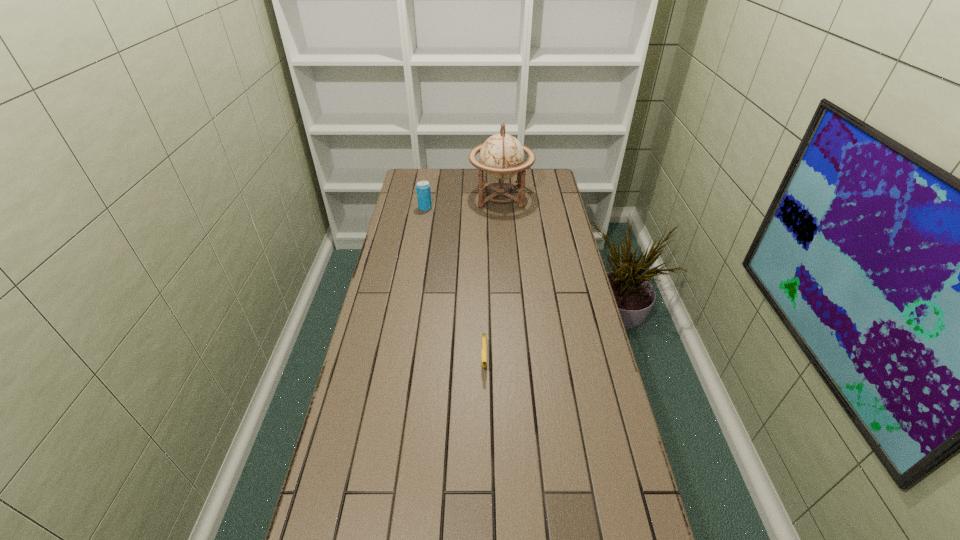
The height and width of the screenshot is (540, 960). In order to click on the tallest object in this screenshot , I will do `click(501, 156)`.

Locate an element on the screen. the second tallest object is located at coordinates (423, 187).

What are the coordinates of `the leftmost object` in the screenshot? It's located at (423, 187).

Find the location of `the nearest object`. the nearest object is located at coordinates (484, 342).

This screenshot has height=540, width=960. In order to click on the shortest object in this screenshot , I will do `click(484, 342)`.

Where is `vacant space located at the front of the globe showing Africa`? The width and height of the screenshot is (960, 540). vacant space located at the front of the globe showing Africa is located at coordinates (450, 196).

You are a GUI agent. You are given a task and a screenshot of the screen. Output one action in this format:
    pyautogui.click(x=<x>, y=<y>)
    Task: Click on the vacant area located 0.150m at the front of the globe showing Africa
    The width and height of the screenshot is (960, 540).
    Given the screenshot: What is the action you would take?
    pyautogui.click(x=438, y=196)

You are a GUI agent. You are given a task and a screenshot of the screen. Output one action in this format:
    pyautogui.click(x=<x>, y=<y>)
    Task: Click on the vacant space situated at the front of the globe showing Africa
    
    Given the screenshot: What is the action you would take?
    pyautogui.click(x=425, y=196)

Where is `vacant space situated on the right of the soda can`? vacant space situated on the right of the soda can is located at coordinates (516, 208).

In order to click on vacant space located at the stem of the nearest object in this screenshot , I will do `click(485, 442)`.